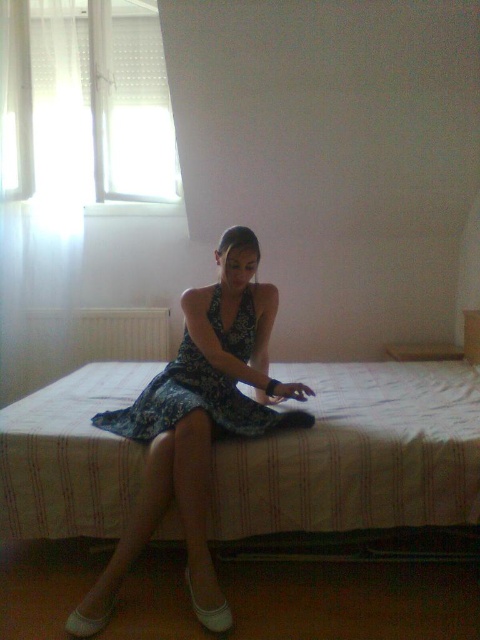
You are helping someone organize their bedroom. They want to place the printed fabric dress at center on the white striped mattress at center. Can the dress fit entirely on the mattress without hanging off the sides?

The white striped mattress at center is wider than the printed fabric dress at center, so the dress can fit entirely on the mattress without hanging off the sides.

You are a photographer setting up a shoot in this room. You want to position a small lamp between the white striped mattress at center and the blue floral dress at center. Which object should the lamp be closer to in order to ensure it is placed between them?

The lamp should be placed closer to the blue floral dress at center because the white striped mattress at center is further away from the viewer, making the blue floral dress at center the closer object. This placement ensures the lamp is positioned between them.

You are a tailor measuring the distance between the white striped mattress at center and the blue floral dress at center for a fitting. The minimum required space for the fitting process is 30 centimeters. Can the fitting proceed in this space?

The distance between the white striped mattress at center and the blue floral dress at center is 32.74 centimeters, which is more than the required 30 centimeters. Therefore, the fitting can proceed in this space.